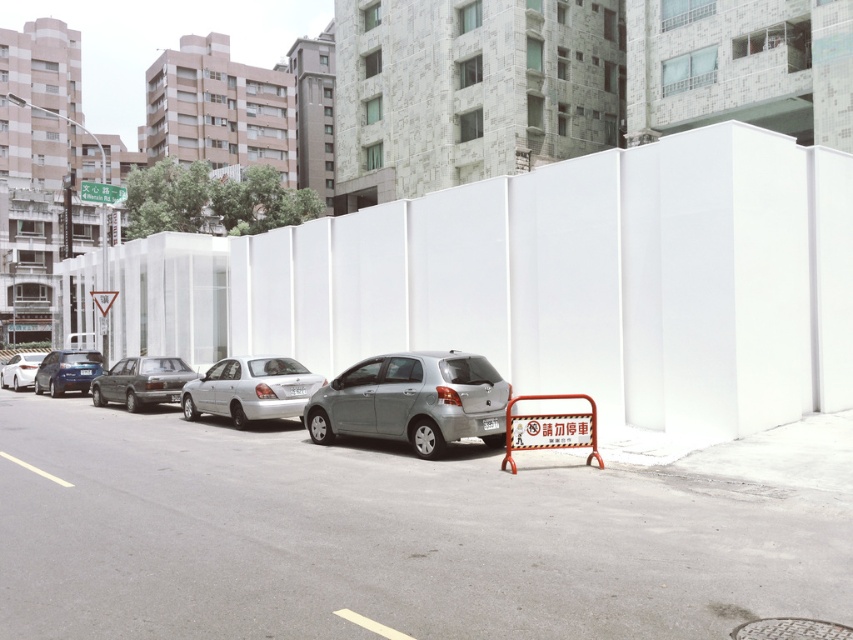
You are standing at the point marked by the coordinates point (141, 381). Looking towards the white wall on the right, which car is closest to you in front of the white wall?

The matte gray sedan at center is closest to you in front of the white wall because it is represented by the point 0.596, 0.166.

You are a delivery driver who needs to park your vehicle in this area. You see the satin silver sedan at center and the green plastic sign at upper left. According to the scene, which object is positioned higher up in the image?

The green plastic sign at upper left is positioned higher up in the image than the satin silver sedan at center.